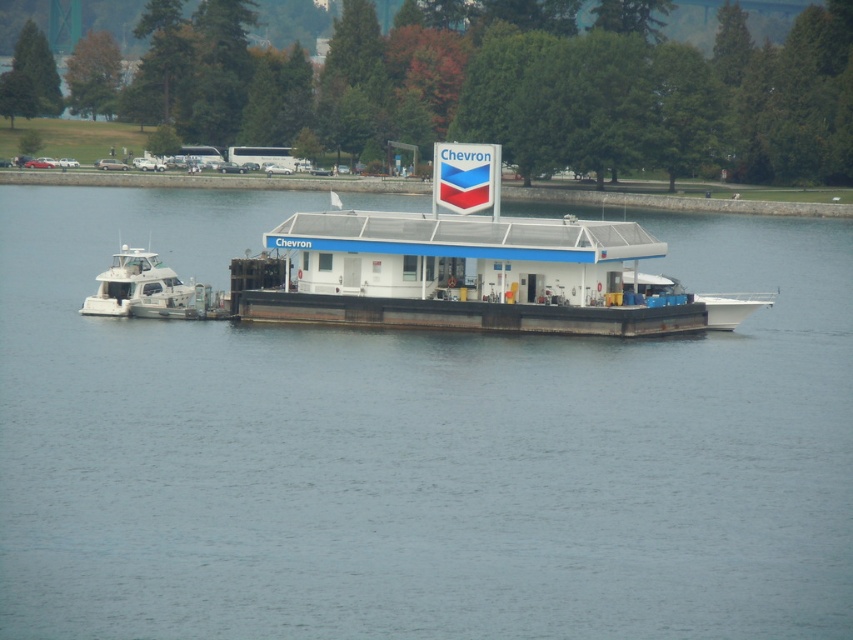
You are a delivery person who needs to unload a package from the white glossy boat at left to the white matte water at center. Can you safely place the package directly from the boat onto the water?

The white matte water at center is much taller than the white glossy boat at left, so the package can be safely placed directly from the boat onto the water.

Looking at this image, based on the scene description, where is the white matte water at center located in terms of coordinates?

The white matte water at center is located at point coordinates of (415, 449).

You are a boater approaching the gas station from the north. You see the white glossy boat at left and the white matte water at center. Which object is closer to your current position?

The white glossy boat at left is closer to your current position because it is positioned to the left of the white matte water at center, and since you are approaching from the north, the boat would be nearer to your starting point.